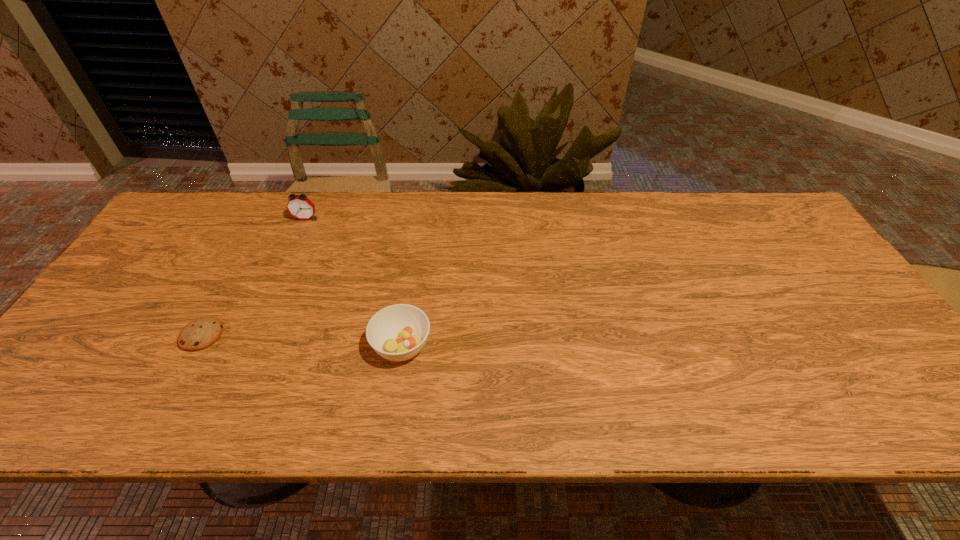
This screenshot has width=960, height=540. I want to click on free point between the cookie and the soup bowl, so click(x=301, y=341).

You are a GUI agent. You are given a task and a screenshot of the screen. Output one action in this format:
    pyautogui.click(x=<x>, y=<y>)
    Task: Click on the vacant area that lies between the tallest object and the soup bowl
    
    Given the screenshot: What is the action you would take?
    pyautogui.click(x=353, y=282)

The height and width of the screenshot is (540, 960). Find the location of `free space between the cookie and the alarm clock`. free space between the cookie and the alarm clock is located at coordinates (253, 277).

Find the location of a particular element. empty location between the soup bowl and the second object from left to right is located at coordinates (353, 282).

Select which object appears as the closest to the second shortest object. Please provide its 2D coordinates. Your answer should be formatted as a tuple, i.e. [(x, y)], where the tuple contains the x and y coordinates of a point satisfying the conditions above.

[(199, 334)]

At what (x,y) coordinates should I click in order to perform the action: click on object that is the closest to the leftmost object. Please return your answer as a coordinate pair (x, y). The width and height of the screenshot is (960, 540). Looking at the image, I should click on (398, 332).

This screenshot has width=960, height=540. Find the location of `vacant region that satisfies the following two spatial constraints: 1. on the clock face of the farthest object; 2. on the right side of the second shortest object`. vacant region that satisfies the following two spatial constraints: 1. on the clock face of the farthest object; 2. on the right side of the second shortest object is located at coordinates (250, 346).

The height and width of the screenshot is (540, 960). I want to click on free location that satisfies the following two spatial constraints: 1. on the clock face of the tallest object; 2. on the right side of the rightmost object, so click(x=250, y=346).

At what (x,y) coordinates should I click in order to perform the action: click on free space that satisfies the following two spatial constraints: 1. on the clock face of the farthest object; 2. on the right side of the rightmost object. Please return your answer as a coordinate pair (x, y). Looking at the image, I should click on (250, 346).

Find the location of a particular element. This screenshot has width=960, height=540. blank space that satisfies the following two spatial constraints: 1. on the clock face of the second shortest object; 2. on the right side of the farthest object is located at coordinates (250, 346).